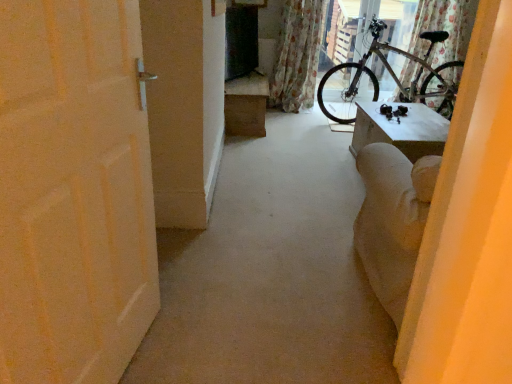
Question: Is white matte door at left at the back of brown cardboard box at center?

Choices:
 (A) yes
 (B) no

Answer: (B)

Question: From a real-world perspective, is brown cardboard box at center over white matte door at left?

Choices:
 (A) no
 (B) yes

Answer: (A)

Question: Is brown cardboard box at center positioned behind white matte door at left?

Choices:
 (A) no
 (B) yes

Answer: (B)

Question: Is brown cardboard box at center shorter than white matte door at left?

Choices:
 (A) no
 (B) yes

Answer: (B)

Question: Could you tell me if brown cardboard box at center is facing white matte door at left?

Choices:
 (A) no
 (B) yes

Answer: (A)

Question: From a real-world perspective, does brown cardboard box at center sit lower than white matte door at left?

Choices:
 (A) no
 (B) yes

Answer: (B)

Question: Can you confirm if silver metallic bicycle at upper right is positioned to the right of brown cardboard box at center?

Choices:
 (A) yes
 (B) no

Answer: (A)

Question: From the image's perspective, is silver metallic bicycle at upper right beneath brown cardboard box at center?

Choices:
 (A) yes
 (B) no

Answer: (B)

Question: Can you confirm if silver metallic bicycle at upper right is smaller than brown cardboard box at center?

Choices:
 (A) no
 (B) yes

Answer: (A)

Question: Considering the relative sizes of silver metallic bicycle at upper right and brown cardboard box at center in the image provided, is silver metallic bicycle at upper right bigger than brown cardboard box at center?

Choices:
 (A) no
 (B) yes

Answer: (B)

Question: Is silver metallic bicycle at upper right wider than brown cardboard box at center?

Choices:
 (A) no
 (B) yes

Answer: (B)

Question: Is brown cardboard box at center inside silver metallic bicycle at upper right?

Choices:
 (A) yes
 (B) no

Answer: (B)

Question: Is silver metallic bicycle at upper right directly adjacent to floral fabric curtain at upper right, the 1th curtain viewed from the left?

Choices:
 (A) no
 (B) yes

Answer: (A)